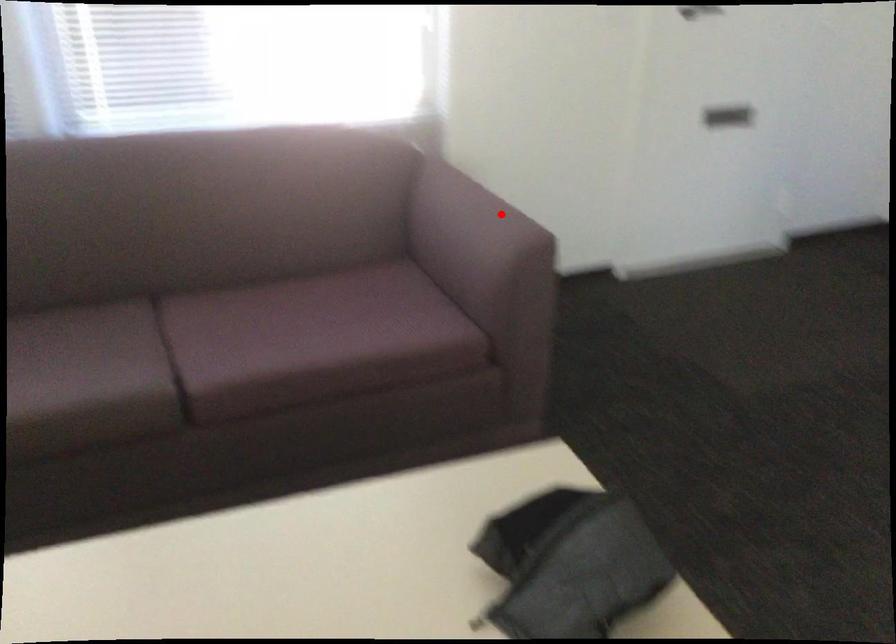
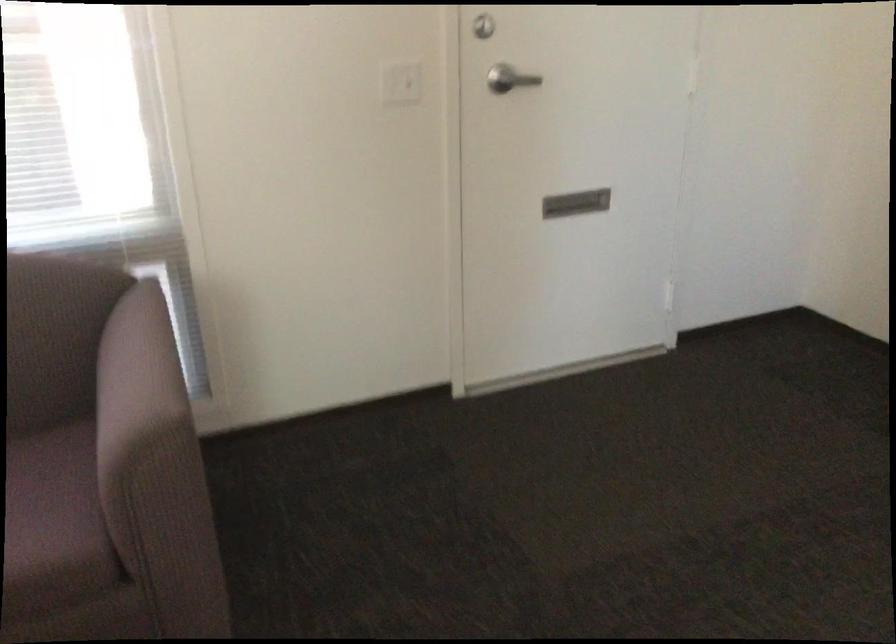
Question: I am providing you with two images of the same scene from different viewpoints. Given a red point in image1, look at the same physical point in image2. Is it:

Choices:
 (A) Closer to the viewpoint
 (B) Farther from the viewpoint

Answer: (A)